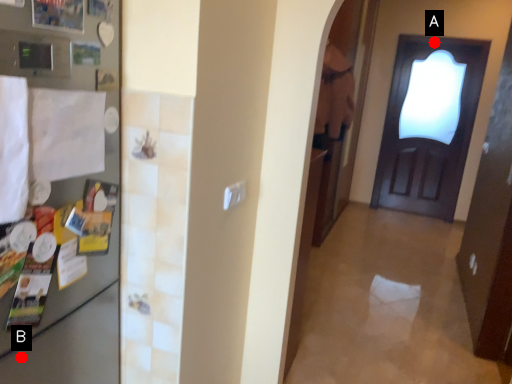
Question: Two points are circled on the image, labeled by A and B beside each circle. Which point is closer to the camera taking this photo?

Choices:
 (A) A is closer
 (B) B is closer

Answer: (B)